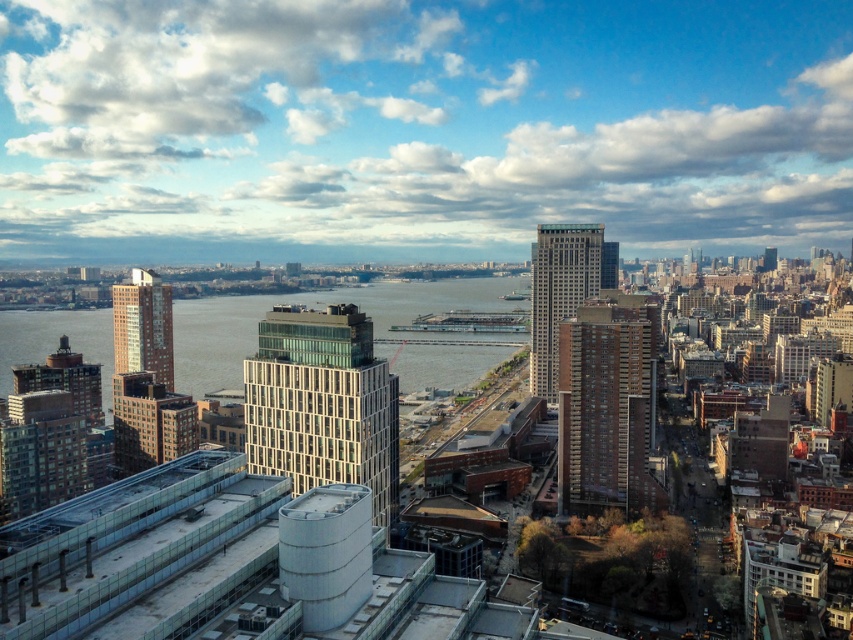
Question: Which point is farther to the camera?

Choices:
 (A) (151, 342)
 (B) (194, 376)

Answer: (B)

Question: Is clear blue water at center smaller than brown brick building at center-right?

Choices:
 (A) no
 (B) yes

Answer: (A)

Question: Among these points, which one is farthest from the camera?

Choices:
 (A) (10, 316)
 (B) (549, 330)
 (C) (120, 291)

Answer: (A)

Question: Which object appears closest to the camera in this image?

Choices:
 (A) glassy concrete skyscraper at center-left
 (B) glassy steel skyscraper at center
 (C) glassy modern building at center

Answer: (C)

Question: Can you confirm if clear blue water at center is positioned above glassy concrete skyscraper at center-left?

Choices:
 (A) yes
 (B) no

Answer: (B)

Question: Observing the image, what is the correct spatial positioning of glassy modern building at center in reference to glassy concrete skyscraper at center-left?

Choices:
 (A) above
 (B) below

Answer: (B)